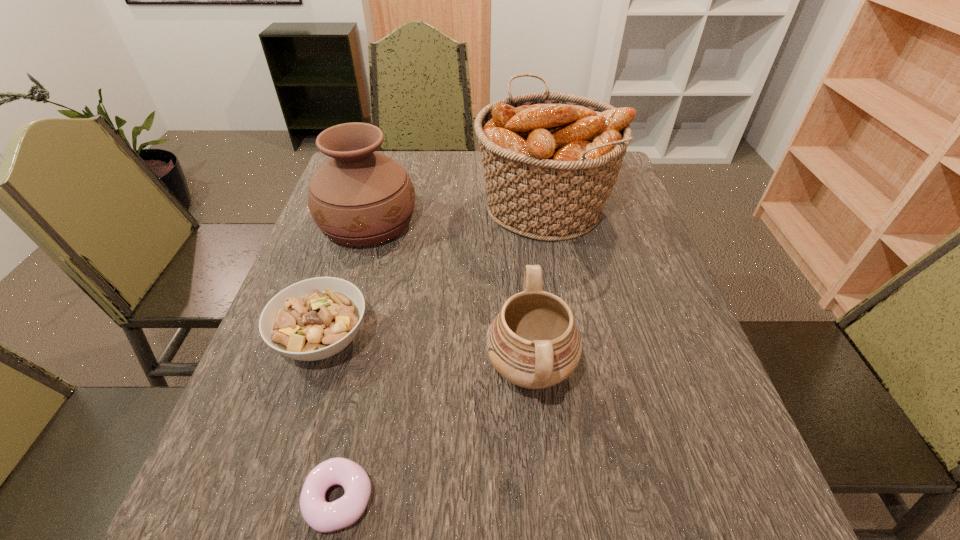
At what (x,y) coordinates should I click in order to perform the action: click on object that is positioned at the far right corner. Please return your answer as a coordinate pair (x, y). This screenshot has height=540, width=960. Looking at the image, I should click on 550,160.

Where is `vacant space at the far edge of the desktop`? vacant space at the far edge of the desktop is located at coordinates (432, 187).

Locate an element on the screen. This screenshot has width=960, height=540. vacant area at the left edge of the desktop is located at coordinates (304, 253).

In the image, there is a desktop. At what (x,y) coordinates should I click in order to perform the action: click on vacant space at the right edge. Please return your answer as a coordinate pair (x, y). The height and width of the screenshot is (540, 960). Looking at the image, I should click on (637, 245).

Find the location of a particular element. free space at the near left corner of the desktop is located at coordinates (214, 490).

Locate an element on the screen. free space between the shorter urn and the second tallest object is located at coordinates (449, 296).

Find the location of a particular element. free space between the doughnut and the nearer urn is located at coordinates (435, 434).

Locate an element on the screen. This screenshot has height=540, width=960. free space between the farther urn and the tallest object is located at coordinates (456, 214).

This screenshot has height=540, width=960. I want to click on free space between the shortest object and the taller urn, so click(353, 361).

I want to click on free point between the shorter urn and the second shortest object, so click(427, 355).